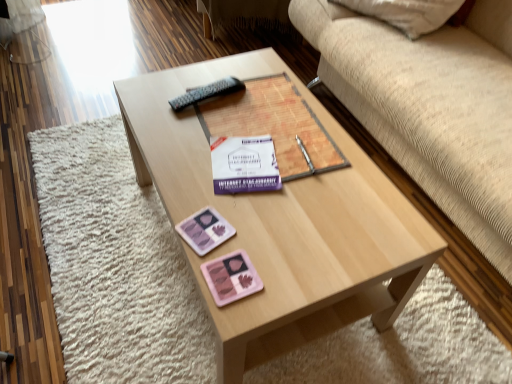
Identify the location of free space in front of white paper at center. The image size is (512, 384). (252, 222).